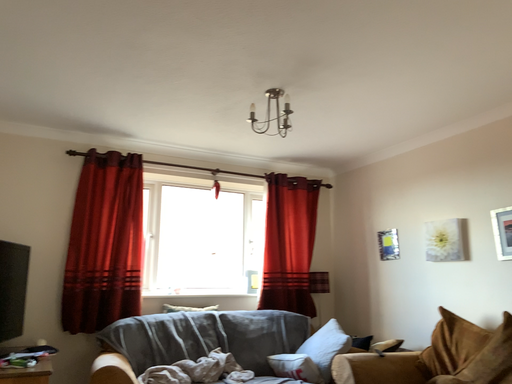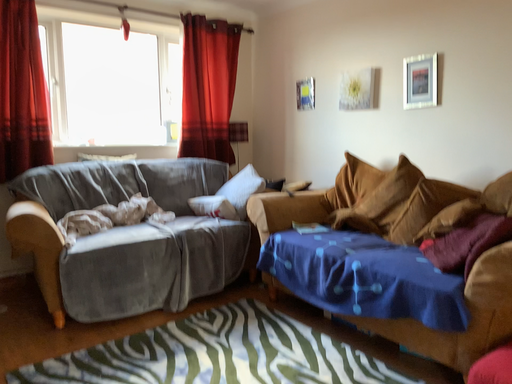
Question: How did the camera likely rotate when shooting the video?

Choices:
 (A) rotated left
 (B) rotated right

Answer: (B)